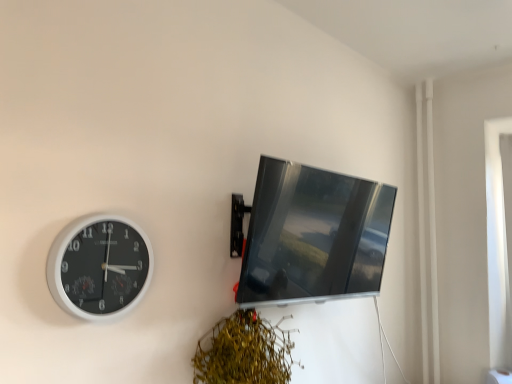
Question: Is white plastic clock at left turned away from green leafy plant at lower center?

Choices:
 (A) yes
 (B) no

Answer: (B)

Question: Does white plastic clock at left turn towards green leafy plant at lower center?

Choices:
 (A) no
 (B) yes

Answer: (A)

Question: Does white plastic clock at left have a larger size compared to green leafy plant at lower center?

Choices:
 (A) yes
 (B) no

Answer: (B)

Question: Can you confirm if white plastic clock at left is positioned to the left of green leafy plant at lower center?

Choices:
 (A) no
 (B) yes

Answer: (B)

Question: From the image's perspective, is white plastic clock at left on green leafy plant at lower center?

Choices:
 (A) yes
 (B) no

Answer: (A)

Question: Visually, is matte black monitor at upper right positioned to the left or to the right of white plastic clock at left?

Choices:
 (A) left
 (B) right

Answer: (B)

Question: Considering the positions of matte black monitor at upper right and white plastic clock at left in the image, is matte black monitor at upper right bigger or smaller than white plastic clock at left?

Choices:
 (A) big
 (B) small

Answer: (A)

Question: Is matte black monitor at upper right wider or thinner than white plastic clock at left?

Choices:
 (A) wide
 (B) thin

Answer: (A)

Question: From their relative heights in the image, would you say matte black monitor at upper right is taller or shorter than white plastic clock at left?

Choices:
 (A) short
 (B) tall

Answer: (B)

Question: Is matte black monitor at upper right to the left or to the right of green leafy plant at lower center in the image?

Choices:
 (A) left
 (B) right

Answer: (B)

Question: Does point (302, 221) appear closer or farther from the camera than point (248, 336)?

Choices:
 (A) closer
 (B) farther

Answer: (B)

Question: Considering the positions of matte black monitor at upper right and green leafy plant at lower center in the image, is matte black monitor at upper right taller or shorter than green leafy plant at lower center?

Choices:
 (A) short
 (B) tall

Answer: (B)

Question: Would you say matte black monitor at upper right is inside or outside green leafy plant at lower center?

Choices:
 (A) inside
 (B) outside

Answer: (B)

Question: Do you think white plastic clock at left is within matte black monitor at upper right, or outside of it?

Choices:
 (A) outside
 (B) inside

Answer: (A)

Question: Would you say white plastic clock at left is to the left or to the right of matte black monitor at upper right in the picture?

Choices:
 (A) right
 (B) left

Answer: (B)